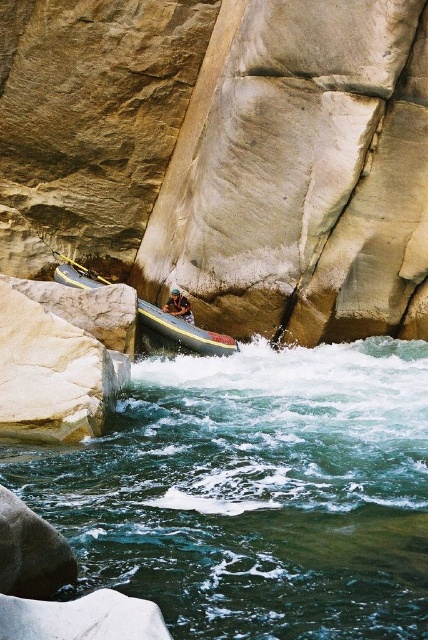
You are a photographer positioned on the riverbank capturing the rafting scene. You notice the white smooth rock at center and the yellow plastic paddle at center. Which object is positioned further to the right from your perspective?

The white smooth rock at center is to the right of the yellow plastic paddle at center, so the white smooth rock at center is positioned further to the right from your perspective.

You are a photographer planning to capture the rafting scene. You have a camera with a 10cm wide lens. The clear blue water at center and the brown leather helmet at center are both in your shot. Can the lens fit both objects side by side without cropping?

The clear blue water at center might be wider than brown leather helmet at center, so the 10cm wide lens may or may not be sufficient depending on their actual widths. Without exact measurements, it is uncertain if both can fit side by side.